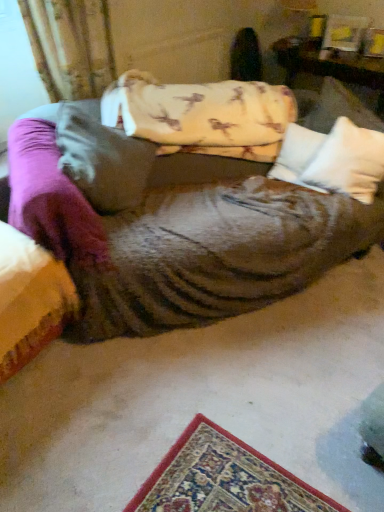
The width and height of the screenshot is (384, 512). Describe the element at coordinates (102, 158) in the screenshot. I see `fluffy white pillow at center, positioned as the first pillow in left-to-right order` at that location.

Describe the element at coordinates (348, 162) in the screenshot. The image size is (384, 512). I see `white soft pillow at center, the 1th pillow positioned from the right` at that location.

Image resolution: width=384 pixels, height=512 pixels. What do you see at coordinates (297, 155) in the screenshot? I see `white soft pillow at center, which is the 2th pillow from right to left` at bounding box center [297, 155].

Locate an element on the screen. fluffy white pillow at center, marked as the third pillow in a right-to-left arrangement is located at coordinates (102, 158).

Is white soft pillow at center, the 1th pillow positioned from the right, at the left side of wooden table at upper right?

Indeed, white soft pillow at center, the 1th pillow positioned from the right, is positioned on the left side of wooden table at upper right.

Looking at this image, considering the positions of objects white soft pillow at center, the 3th pillow viewed from the left, and wooden table at upper right in the image provided, who is in front, white soft pillow at center, the 3th pillow viewed from the left, or wooden table at upper right?

white soft pillow at center, the 3th pillow viewed from the left, is in front.

Considering the relative sizes of white soft pillow at center, the 1th pillow positioned from the right, and wooden table at upper right in the image provided, is white soft pillow at center, the 1th pillow positioned from the right, taller than wooden table at upper right?

Correct, white soft pillow at center, the 1th pillow positioned from the right, is much taller as wooden table at upper right.

Is wooden table at upper right surrounded by white soft pillow at center, which is the 2th pillow from right to left?

Actually, wooden table at upper right is outside white soft pillow at center, which is the 2th pillow from right to left.

Considering the relative sizes of white soft pillow at center, which is the 2th pillow from right to left, and wooden table at upper right in the image provided, is white soft pillow at center, which is the 2th pillow from right to left, bigger than wooden table at upper right?

Incorrect, white soft pillow at center, which is the 2th pillow from right to left, is not larger than wooden table at upper right.

Is white soft pillow at center, placed as the 2th pillow when sorted from left to right, aimed at wooden table at upper right?

No, white soft pillow at center, placed as the 2th pillow when sorted from left to right, is not turned towards wooden table at upper right.

From a real-world perspective, which is physically below, wooden table at upper right or white soft pillow at center, placed as the 2th pillow when sorted from left to right?

white soft pillow at center, placed as the 2th pillow when sorted from left to right, is physically lower.

Is wooden table at upper right oriented towards white soft pillow at center, placed as the 2th pillow when sorted from left to right?

Yes, wooden table at upper right is facing white soft pillow at center, placed as the 2th pillow when sorted from left to right.

Considering the positions of point (320, 64) and point (272, 178), is point (320, 64) closer or farther from the camera than point (272, 178)?

Point (320, 64) is farther from the camera than point (272, 178).

Is white soft pillow at center, placed as the 2th pillow when sorted from left to right, located within wooden table at upper right?

No, white soft pillow at center, placed as the 2th pillow when sorted from left to right, is not inside wooden table at upper right.

Is fluffy white pillow at center, marked as the third pillow in a right-to-left arrangement, outside of white soft pillow at center, which is the 2th pillow from right to left?

Yes.

Which of these two, fluffy white pillow at center, positioned as the first pillow in left-to-right order, or white soft pillow at center, placed as the 2th pillow when sorted from left to right, is smaller?

With smaller size is white soft pillow at center, placed as the 2th pillow when sorted from left to right.

Is fluffy white pillow at center, marked as the third pillow in a right-to-left arrangement, shorter than white soft pillow at center, which is the 2th pillow from right to left?

In fact, fluffy white pillow at center, marked as the third pillow in a right-to-left arrangement, may be taller than white soft pillow at center, which is the 2th pillow from right to left.

From the image's perspective, is fluffy white pillow at center, marked as the third pillow in a right-to-left arrangement, above white soft pillow at center, placed as the 2th pillow when sorted from left to right?

No, from the image's perspective, fluffy white pillow at center, marked as the third pillow in a right-to-left arrangement, is not on top of white soft pillow at center, placed as the 2th pillow when sorted from left to right.

You are a GUI agent. You are given a task and a screenshot of the screen. Output one action in this format:
    pyautogui.click(x=<x>, y=<y>)
    Task: Click on the pillow located below the white soft pillow at center, the 1th pillow positioned from the right (from the image's perspective)
    
    Given the screenshot: What is the action you would take?
    pyautogui.click(x=102, y=158)

Can we say fluffy white pillow at center, positioned as the first pillow in left-to-right order, lies outside white soft pillow at center, the 3th pillow viewed from the left?

Absolutely, fluffy white pillow at center, positioned as the first pillow in left-to-right order, is external to white soft pillow at center, the 3th pillow viewed from the left.

Does fluffy white pillow at center, positioned as the first pillow in left-to-right order, have a greater width compared to white soft pillow at center, the 3th pillow viewed from the left?

Yes.

Which object is further away from the camera taking this photo, fluffy white pillow at center, positioned as the first pillow in left-to-right order, or white soft pillow at center, the 3th pillow viewed from the left?

white soft pillow at center, the 3th pillow viewed from the left.

In the image, is white soft pillow at center, placed as the 2th pillow when sorted from left to right, positioned in front of or behind white soft pillow at center, the 3th pillow viewed from the left?

Visually, white soft pillow at center, placed as the 2th pillow when sorted from left to right, is located behind white soft pillow at center, the 3th pillow viewed from the left.

Which point is more distant from viewer, (301, 165) or (335, 145)?

The point (301, 165) is farther from the camera.

From a real-world perspective, is white soft pillow at center, which is the 2th pillow from right to left, located beneath white soft pillow at center, the 3th pillow viewed from the left?

Yes.

Can you confirm if white soft pillow at center, the 3th pillow viewed from the left, is thinner than white soft pillow at center, which is the 2th pillow from right to left?

Incorrect, the width of white soft pillow at center, the 3th pillow viewed from the left, is not less than that of white soft pillow at center, which is the 2th pillow from right to left.

Image resolution: width=384 pixels, height=512 pixels. I want to click on pillow behind the white soft pillow at center, the 3th pillow viewed from the left, so click(297, 155).

From the image's perspective, would you say white soft pillow at center, the 3th pillow viewed from the left, is shown under white soft pillow at center, which is the 2th pillow from right to left?

Yes, from the image's perspective, white soft pillow at center, the 3th pillow viewed from the left, is below white soft pillow at center, which is the 2th pillow from right to left.

Consider the image. Which is more to the right, white soft pillow at center, the 1th pillow positioned from the right, or white soft pillow at center, placed as the 2th pillow when sorted from left to right?

Positioned to the right is white soft pillow at center, the 1th pillow positioned from the right.

This screenshot has height=512, width=384. I want to click on the 2nd pillow in front of the wooden table at upper right, so click(348, 162).

Where is `furniture that is above the white soft pillow at center, placed as the 2th pillow when sorted from left to right (from the image's perspective)`? Image resolution: width=384 pixels, height=512 pixels. furniture that is above the white soft pillow at center, placed as the 2th pillow when sorted from left to right (from the image's perspective) is located at coordinates (333, 69).

From the image, which object appears to be nearer to white soft pillow at center, the 1th pillow positioned from the right, white soft pillow at center, placed as the 2th pillow when sorted from left to right, or fluffy white pillow at center, marked as the third pillow in a right-to-left arrangement?

white soft pillow at center, placed as the 2th pillow when sorted from left to right, is positioned closer to the anchor white soft pillow at center, the 1th pillow positioned from the right.

When comparing their distances from white soft pillow at center, the 3th pillow viewed from the left, does wooden table at upper right or fluffy white pillow at center, positioned as the first pillow in left-to-right order, seem closer?

wooden table at upper right.

When comparing their distances from white soft pillow at center, which is the 2th pillow from right to left, does wooden table at upper right or fluffy white pillow at center, positioned as the first pillow in left-to-right order, seem closer?

wooden table at upper right is closer to white soft pillow at center, which is the 2th pillow from right to left.

From the picture: Considering their positions, is white soft pillow at center, placed as the 2th pillow when sorted from left to right, positioned further to fluffy white pillow at center, positioned as the first pillow in left-to-right order, than white soft pillow at center, the 3th pillow viewed from the left?

The object further to fluffy white pillow at center, positioned as the first pillow in left-to-right order, is white soft pillow at center, the 3th pillow viewed from the left.

Based on their spatial positions, is white soft pillow at center, which is the 2th pillow from right to left, or white soft pillow at center, the 3th pillow viewed from the left, closer to wooden table at upper right?

white soft pillow at center, the 3th pillow viewed from the left, is closer to wooden table at upper right.

Considering their positions, is wooden table at upper right positioned further to white soft pillow at center, which is the 2th pillow from right to left, than white soft pillow at center, the 3th pillow viewed from the left?

Based on the image, wooden table at upper right appears to be further to white soft pillow at center, which is the 2th pillow from right to left.

Based on their spatial positions, is fluffy white pillow at center, positioned as the first pillow in left-to-right order, or wooden table at upper right closer to white soft pillow at center, which is the 2th pillow from right to left?

Based on the image, wooden table at upper right appears to be nearer to white soft pillow at center, which is the 2th pillow from right to left.

Based on their spatial positions, is fluffy white pillow at center, marked as the third pillow in a right-to-left arrangement, or wooden table at upper right further from white soft pillow at center, the 1th pillow positioned from the right?

fluffy white pillow at center, marked as the third pillow in a right-to-left arrangement, lies further to white soft pillow at center, the 1th pillow positioned from the right, than the other object.

Find the location of a particular element. pillow between fluffy white pillow at center, positioned as the first pillow in left-to-right order, and white soft pillow at center, the 3th pillow viewed from the left is located at coordinates (297, 155).

Locate an element on the screen. This screenshot has height=512, width=384. pillow between white soft pillow at center, the 1th pillow positioned from the right, and wooden table at upper right, along the z-axis is located at coordinates (297, 155).